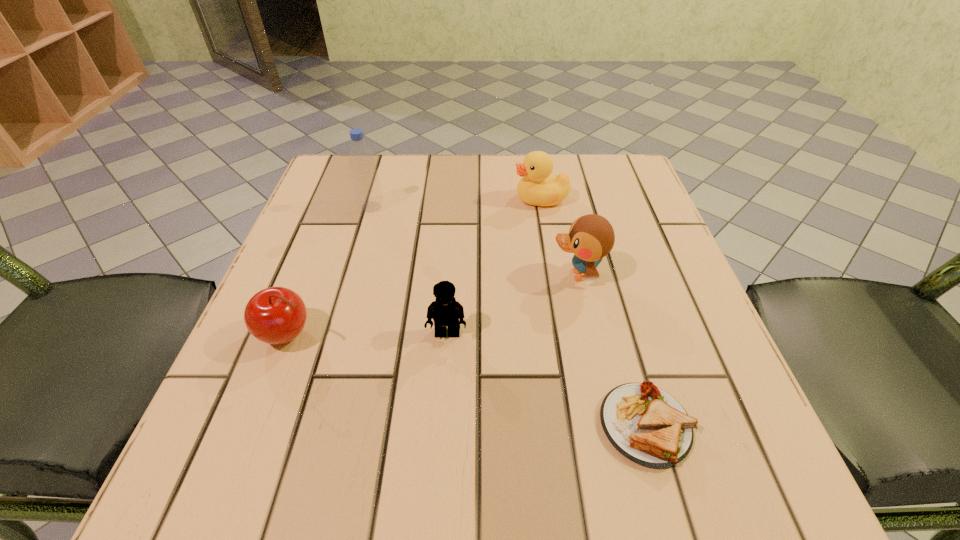
You are a GUI agent. You are given a task and a screenshot of the screen. Output one action in this format:
    pyautogui.click(x=<x>, y=<y>)
    Task: Click on the tallest object
    The width and height of the screenshot is (960, 540).
    Given the screenshot: What is the action you would take?
    pyautogui.click(x=368, y=193)

The image size is (960, 540). I want to click on the fourth nearest object, so click(591, 237).

Identify the location of the farther duck. (537, 187).

What are the coordinates of `cherry` in the screenshot? It's located at (276, 315).

At what (x,y) coordinates should I click in order to perform the action: click on the fourth object from right to left. Please return your answer as a coordinate pair (x, y). Looking at the image, I should click on (445, 311).

Find the location of `the nearest object`. the nearest object is located at coordinates (647, 425).

Where is `sandwich`? This screenshot has height=540, width=960. sandwich is located at coordinates (647, 425).

Locate an element on the screen. The height and width of the screenshot is (540, 960). free space located 0.220m on the front of the tallest object is located at coordinates (348, 288).

The image size is (960, 540). Find the location of `blank space located 0.360m on the front-facing side of the nearer duck`. blank space located 0.360m on the front-facing side of the nearer duck is located at coordinates (356, 275).

This screenshot has height=540, width=960. Find the location of `vacant space located on the front-facing side of the nearer duck`. vacant space located on the front-facing side of the nearer duck is located at coordinates (523, 275).